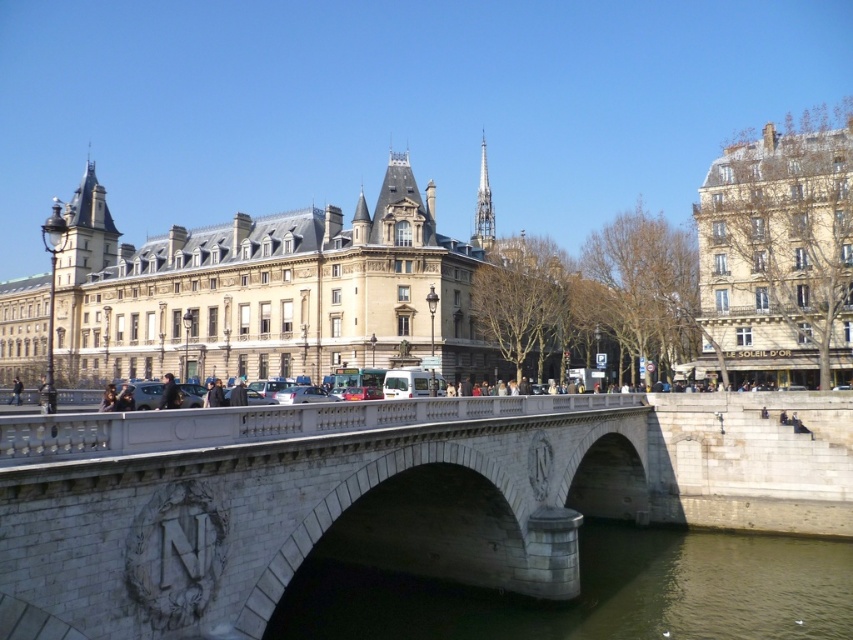
Question: Which object is closer to the camera taking this photo?

Choices:
 (A) dark gray stone person at center
 (B) matte black car at center
 (C) white stone bridge at center

Answer: (C)

Question: Is white stone bridge at center smaller than metallic silver car at center?

Choices:
 (A) no
 (B) yes

Answer: (A)

Question: Which point is farther to the camera?

Choices:
 (A) (763, 184)
 (B) (292, 403)
 (C) (740, 541)

Answer: (A)

Question: Where is beige stone building at right located in relation to dark gray stone person at center in the image?

Choices:
 (A) left
 (B) right

Answer: (B)

Question: Can you confirm if beige stone building at right is wider than metallic silver car at center?

Choices:
 (A) yes
 (B) no

Answer: (A)

Question: Based on their relative distances, which object is farther from the metallic silver car at center?

Choices:
 (A) matte black car at center
 (B) dark gray jacket at center
 (C) dark gray stone person at center
 (D) dark gray stone water at lower center

Answer: (C)